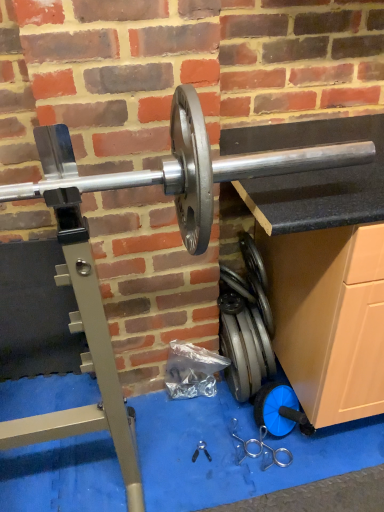
Question: Is silver metallic weight at lower center, acting as the 1th tool starting from the right, to the left or to the right of silver metallic barbell at center in the image?

Choices:
 (A) left
 (B) right

Answer: (B)

Question: From their relative heights in the image, would you say silver metallic weight at lower center, the second tool from the left, is taller or shorter than silver metallic barbell at center?

Choices:
 (A) tall
 (B) short

Answer: (B)

Question: Which of these objects is positioned closest to the silver metallic barbell at center?

Choices:
 (A) silver metallic weight at lower center, the second tool from the left
 (B) black plastic pliers at center, which is the 2th tool from right to left

Answer: (A)

Question: Based on their relative distances, which object is nearer to the silver metallic barbell at center?

Choices:
 (A) silver metallic weight at lower center, acting as the 1th tool starting from the right
 (B) black plastic pliers at center, placed as the first tool when sorted from left to right

Answer: (A)